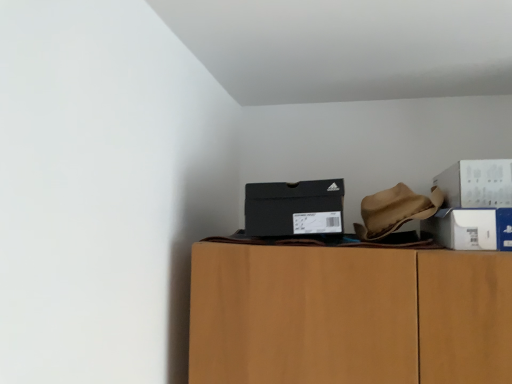
Question: Is point (494, 173) closer or farther from the camera than point (509, 233)?

Choices:
 (A) closer
 (B) farther

Answer: (B)

Question: Looking at their shapes, would you say white cardboard box at upper right, the third box in the left-to-right sequence, is wider or thinner than white cardboard box at right, which is the second box from left to right?

Choices:
 (A) thin
 (B) wide

Answer: (B)

Question: Estimate the real-world distances between objects in this image. Which object is closer to the black matte shoebox at upper center, the 3th box from the right?

Choices:
 (A) white cardboard box at upper right, which is the first box from right to left
 (B) white cardboard box at right, which is the second box from left to right

Answer: (B)

Question: Which of these objects is positioned closest to the white cardboard box at right, which is the second box from left to right?

Choices:
 (A) black matte shoebox at upper center, the 3th box from the right
 (B) white cardboard box at upper right, which is the first box from right to left

Answer: (B)